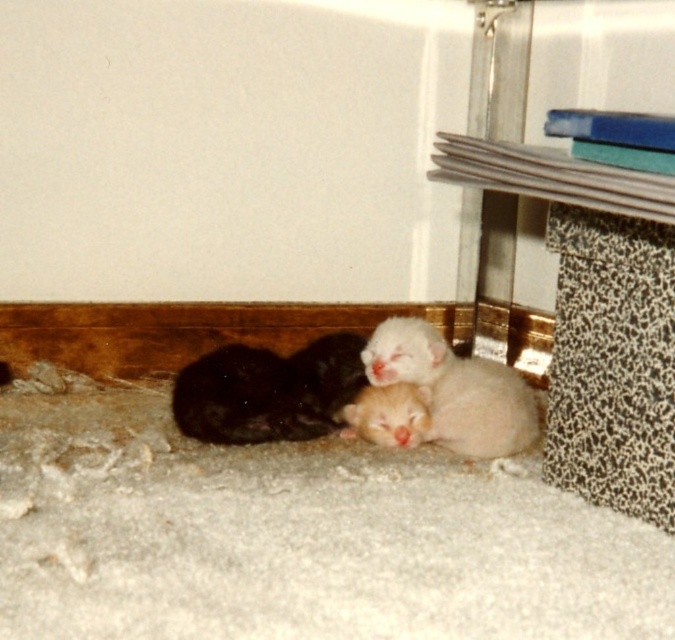
Question: Is soft fur kitten at lower left thinner than fluffy white kitten at lower center?

Choices:
 (A) no
 (B) yes

Answer: (A)

Question: Which object is closer to the camera taking this photo?

Choices:
 (A) soft fur kitten at lower left
 (B) fluffy white kitten at lower center

Answer: (B)

Question: Is soft fur kitten at lower left to the left of fluffy white kitten at lower center from the viewer's perspective?

Choices:
 (A) no
 (B) yes

Answer: (B)

Question: Does soft fur kitten at lower left appear over fluffy white kitten at lower center?

Choices:
 (A) no
 (B) yes

Answer: (A)

Question: Which of the following is the closest to the observer?

Choices:
 (A) soft fur kitten at lower left
 (B) fluffy white kitten at lower center

Answer: (B)